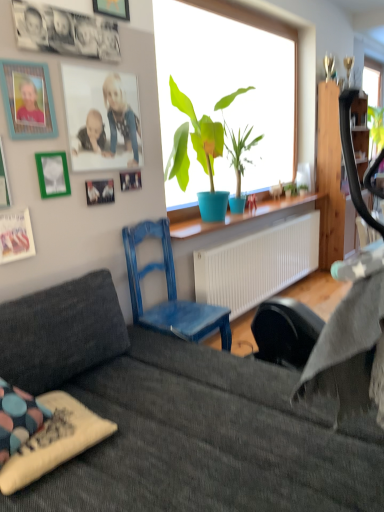
Question: Considering the relative sizes of teal wooden picture frame at upper left, positioned as the 3th picture frame in top-to-bottom order, and matte plastic picture frame at upper left, which is the seventh picture frame from bottom to top, in the image provided, is teal wooden picture frame at upper left, positioned as the 3th picture frame in top-to-bottom order, bigger than matte plastic picture frame at upper left, which is the seventh picture frame from bottom to top,?

Choices:
 (A) no
 (B) yes

Answer: (A)

Question: Can you confirm if teal wooden picture frame at upper left, which is counted as the 6th picture frame, starting from the bottom, is smaller than matte plastic picture frame at upper left, acting as the second picture frame starting from the top?

Choices:
 (A) no
 (B) yes

Answer: (B)

Question: Is teal wooden picture frame at upper left, which is counted as the 6th picture frame, starting from the bottom, completely or partially outside of matte plastic picture frame at upper left, which is the seventh picture frame from bottom to top?

Choices:
 (A) no
 (B) yes

Answer: (B)

Question: Is there a large distance between teal wooden picture frame at upper left, positioned as the 3th picture frame in top-to-bottom order, and matte plastic picture frame at upper left, which is the seventh picture frame from bottom to top?

Choices:
 (A) no
 (B) yes

Answer: (A)

Question: Can you confirm if teal wooden picture frame at upper left, positioned as the 3th picture frame in top-to-bottom order, is shorter than matte plastic picture frame at upper left, which is the seventh picture frame from bottom to top?

Choices:
 (A) yes
 (B) no

Answer: (A)

Question: Looking at their shapes, would you say metallic silver picture frame at left, which is the first picture frame in bottom-to-top order, is wider or thinner than green matte picture frame at upper left, which is the 2th picture frame from bottom to top?

Choices:
 (A) thin
 (B) wide

Answer: (A)

Question: From the image's perspective, is metallic silver picture frame at left, which ranks as the 8th picture frame in top-to-bottom order, above or below green matte picture frame at upper left, the 7th picture frame when ordered from top to bottom?

Choices:
 (A) below
 (B) above

Answer: (A)

Question: In terms of size, does metallic silver picture frame at left, which is the first picture frame in bottom-to-top order, appear bigger or smaller than green matte picture frame at upper left, which is the 2th picture frame from bottom to top?

Choices:
 (A) small
 (B) big

Answer: (A)

Question: Is metallic silver picture frame at left, which is the first picture frame in bottom-to-top order, taller or shorter than green matte picture frame at upper left, which is the 2th picture frame from bottom to top?

Choices:
 (A) tall
 (B) short

Answer: (B)

Question: Looking at the image, does teal wooden picture frame at upper left, which is counted as the 6th picture frame, starting from the bottom, seem bigger or smaller compared to polka dot fabric pillow at lower left?

Choices:
 (A) small
 (B) big

Answer: (A)

Question: Visually, is teal wooden picture frame at upper left, positioned as the 3th picture frame in top-to-bottom order, positioned to the left or to the right of polka dot fabric pillow at lower left?

Choices:
 (A) right
 (B) left

Answer: (B)

Question: Is teal wooden picture frame at upper left, positioned as the 3th picture frame in top-to-bottom order, inside or outside of polka dot fabric pillow at lower left?

Choices:
 (A) outside
 (B) inside

Answer: (A)

Question: From their relative heights in the image, would you say teal wooden picture frame at upper left, positioned as the 3th picture frame in top-to-bottom order, is taller or shorter than polka dot fabric pillow at lower left?

Choices:
 (A) tall
 (B) short

Answer: (A)

Question: Visually, is wooden picture frame at upper left, the 8th picture frame in the bottom-to-top sequence, positioned to the left or to the right of dark gray fabric couch at lower center?

Choices:
 (A) left
 (B) right

Answer: (A)

Question: Is wooden picture frame at upper left, the 8th picture frame in the bottom-to-top sequence, bigger or smaller than dark gray fabric couch at lower center?

Choices:
 (A) small
 (B) big

Answer: (A)